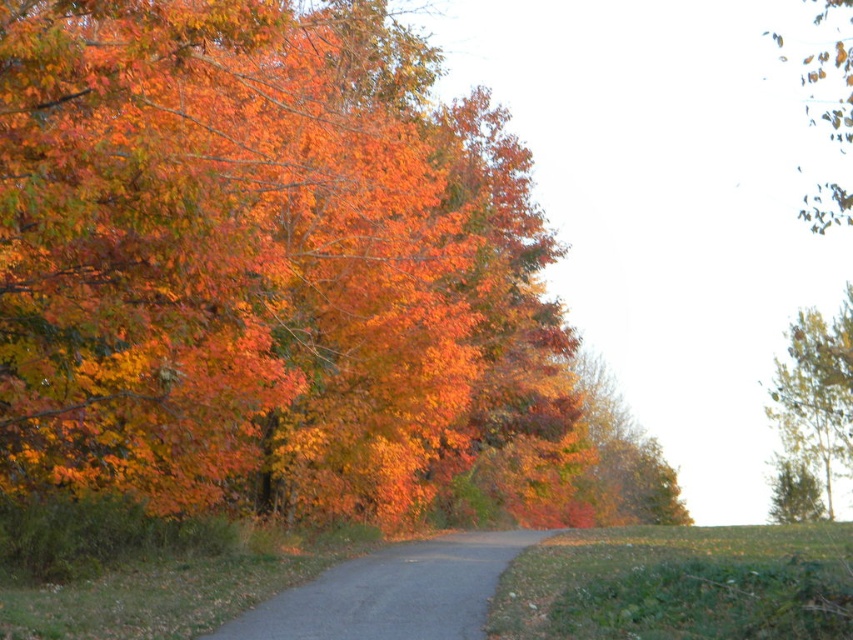
Is gray asphalt road at center further to the viewer compared to smooth brown tree trunk at upper right?

That is False.

Can you confirm if gray asphalt road at center is positioned below smooth brown tree trunk at upper right?

Yes.

The height and width of the screenshot is (640, 853). Identify the location of gray asphalt road at center. (393, 593).

Does shiny orange leaves at left appear under smooth brown tree trunk at upper right?

Actually, shiny orange leaves at left is above smooth brown tree trunk at upper right.

In the scene shown: Who is positioned more to the right, shiny orange leaves at left or smooth brown tree trunk at upper right?

smooth brown tree trunk at upper right is more to the right.

Who is more forward, (56, 442) or (805, 422)?

Point (56, 442) is in front.

Find the location of `shiny orange leaves at left`. shiny orange leaves at left is located at coordinates (259, 260).

Measure the distance between point (x=346, y=589) and camera.

The distance of point (x=346, y=589) from camera is 42.45 feet.

Can you confirm if gray asphalt road at center is positioned to the right of orange matte tree at center?

Incorrect, gray asphalt road at center is not on the right side of orange matte tree at center.

Is point (451, 556) farther from camera compared to point (618, 493)?

No, (451, 556) is closer to viewer.

What are the coordinates of `gray asphalt road at center` in the screenshot? It's located at (393, 593).